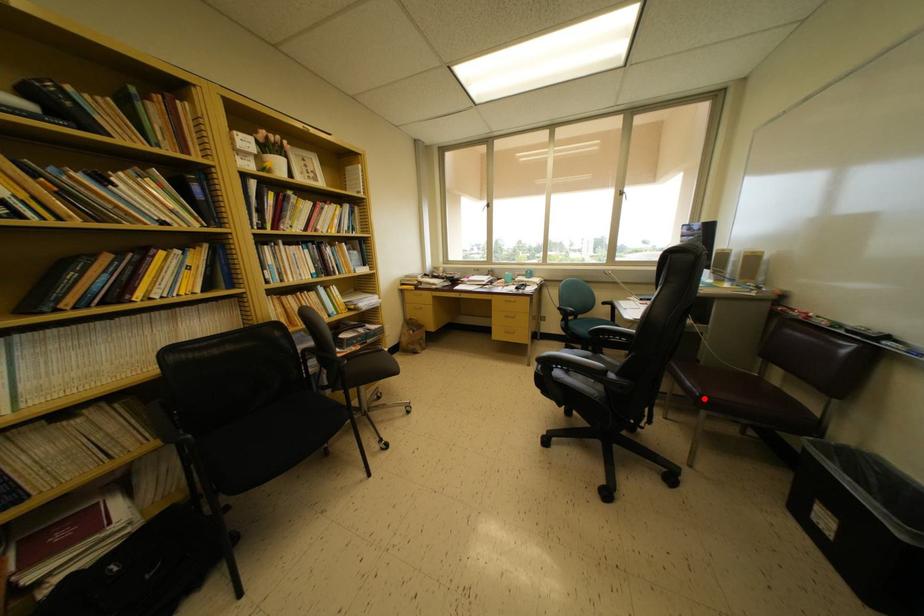
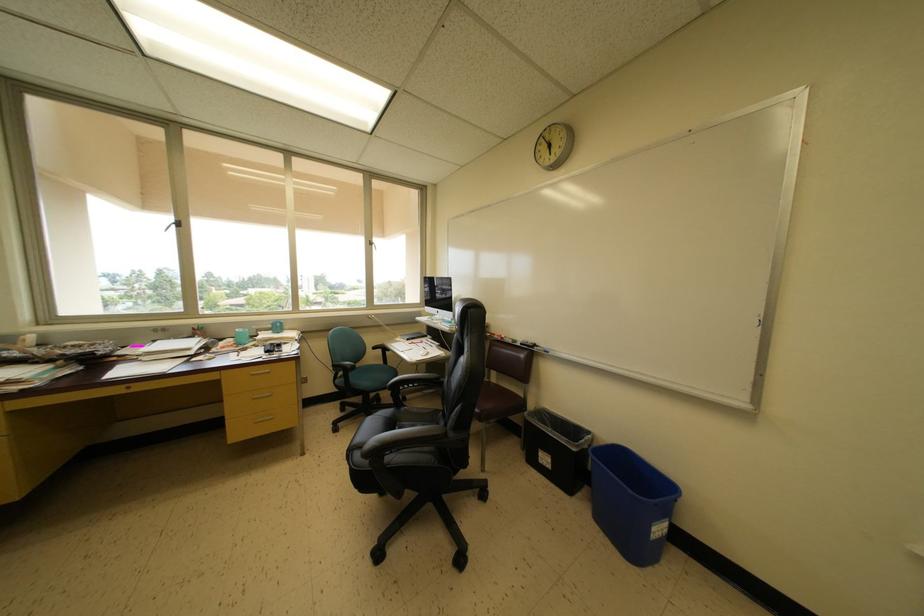
Find the pixel in the second image that matches the highlighted location in the first image.

(485, 416)